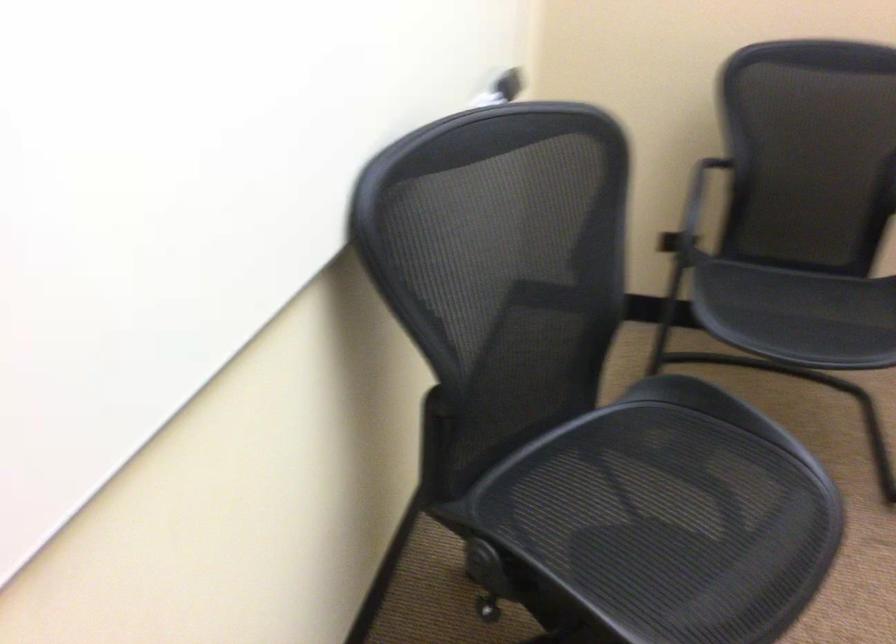
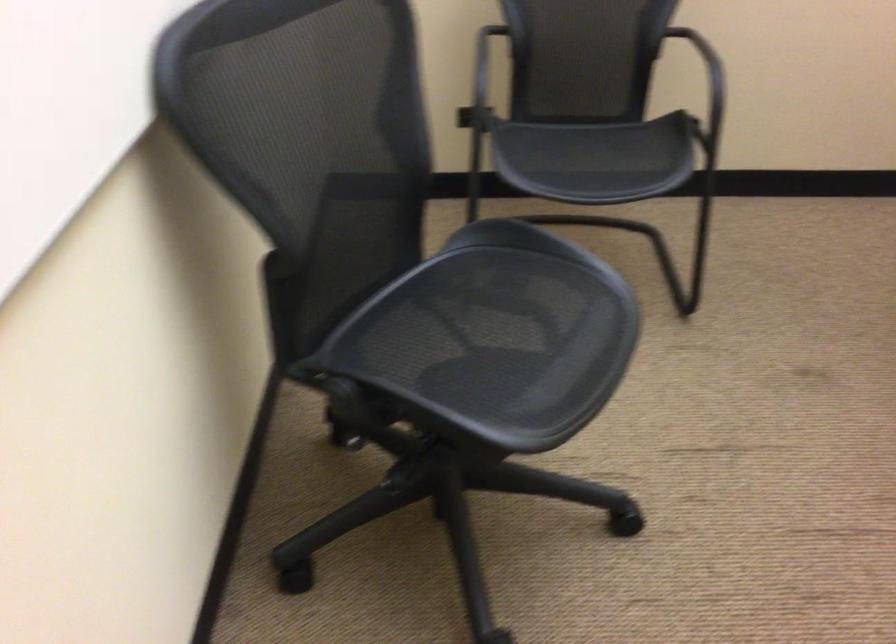
Question: The camera is either moving clockwise (left) or counter-clockwise (right) around the object. The first image is from the beginning of the video and the second image is from the end. Is the camera moving left or right when shooting the video?

Choices:
 (A) Left
 (B) Right

Answer: (A)